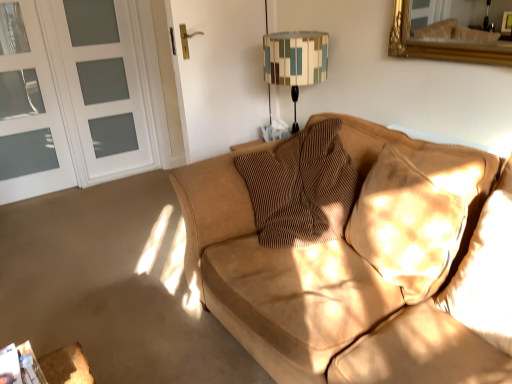
Image resolution: width=512 pixels, height=384 pixels. What do you see at coordinates (29, 110) in the screenshot?
I see `white glass screen door at left, placed as the 1th screen door when sorted from left to right` at bounding box center [29, 110].

This screenshot has height=384, width=512. What are the coordinates of `white glass screen door at left, placed as the 1th screen door when sorted from left to right` in the screenshot? It's located at (29, 110).

In order to face white frosted glass screen door at left, which is the 2th screen door in left-to-right order, should I rotate leftwards or rightwards?

Rotate your view left by about 19.313°.

Describe the element at coordinates (413, 216) in the screenshot. The image size is (512, 384). I see `suede pillow at right, positioned as the second pillow in right-to-left order` at that location.

What do you see at coordinates (301, 187) in the screenshot? This screenshot has height=384, width=512. I see `brown textured pillow at center, which is the 3th pillow from right to left` at bounding box center [301, 187].

Image resolution: width=512 pixels, height=384 pixels. In order to click on brown textured pillow at center, positioned as the 1th pillow in left-to-right order in this screenshot , I will do `click(301, 187)`.

Image resolution: width=512 pixels, height=384 pixels. What do you see at coordinates (487, 271) in the screenshot?
I see `suede pillow at right, the first pillow from the right` at bounding box center [487, 271].

What are the coordinates of `white glass screen door at left, placed as the 1th screen door when sorted from left to right` in the screenshot? It's located at (29, 110).

Looking at their sizes, would you say suede pillow at right, which is the second pillow from left to right, is wider or thinner than suede pillow at right, which ranks as the third pillow in left-to-right order?

suede pillow at right, which is the second pillow from left to right, is thinner than suede pillow at right, which ranks as the third pillow in left-to-right order.

Does suede pillow at right, which is the second pillow from left to right, appear on the right side of suede pillow at right, which ranks as the third pillow in left-to-right order?

Incorrect, suede pillow at right, which is the second pillow from left to right, is not on the right side of suede pillow at right, which ranks as the third pillow in left-to-right order.

Is point (403, 297) positioned before point (470, 308)?

No.

From the image's perspective, is white glass screen door at left, placed as the 1th screen door when sorted from left to right, on top of white frosted glass screen door at left, which ranks as the first screen door in right-to-left order?

No, from the image's perspective, white glass screen door at left, placed as the 1th screen door when sorted from left to right, is not on top of white frosted glass screen door at left, which ranks as the first screen door in right-to-left order.

Consider the image. Is white glass screen door at left, placed as the 1th screen door when sorted from left to right, completely or partially outside of white frosted glass screen door at left, which ranks as the first screen door in right-to-left order?

Yes, white glass screen door at left, placed as the 1th screen door when sorted from left to right, is not within white frosted glass screen door at left, which ranks as the first screen door in right-to-left order.

Which object is positioned more to the right, white glass screen door at left, the 2th screen door from the right, or white frosted glass screen door at left, which is the 2th screen door in left-to-right order?

white frosted glass screen door at left, which is the 2th screen door in left-to-right order, is more to the right.

In the scene shown: Can you confirm if white glass screen door at left, placed as the 1th screen door when sorted from left to right, is shorter than suede pillow at right, which ranks as the third pillow in left-to-right order?

No, white glass screen door at left, placed as the 1th screen door when sorted from left to right, is not shorter than suede pillow at right, which ranks as the third pillow in left-to-right order.

In the scene shown: From a real-world perspective, which object rests below the other?

suede pillow at right, which ranks as the third pillow in left-to-right order, is physically lower.

Is white glass screen door at left, the 2th screen door from the right, bigger or smaller than suede pillow at right, the first pillow from the right?

white glass screen door at left, the 2th screen door from the right, is bigger than suede pillow at right, the first pillow from the right.

Looking at this image, does geometric fabric lampshade at upper center turn towards suede pillow at right, which ranks as the third pillow in left-to-right order?

No, geometric fabric lampshade at upper center is not oriented towards suede pillow at right, which ranks as the third pillow in left-to-right order.

From the image's perspective, which object appears higher, geometric fabric lampshade at upper center or suede pillow at right, which ranks as the third pillow in left-to-right order?

geometric fabric lampshade at upper center.

Is geometric fabric lampshade at upper center in contact with suede pillow at right, which ranks as the third pillow in left-to-right order?

No.

Considering the sizes of objects geometric fabric lampshade at upper center and suede pillow at right, which ranks as the third pillow in left-to-right order, in the image provided, who is thinner, geometric fabric lampshade at upper center or suede pillow at right, which ranks as the third pillow in left-to-right order,?

Thinner between the two is suede pillow at right, which ranks as the third pillow in left-to-right order.

Is geometric fabric lampshade at upper center in front of or behind white frosted glass screen door at left, which ranks as the first screen door in right-to-left order, in the image?

Visually, geometric fabric lampshade at upper center is located in front of white frosted glass screen door at left, which ranks as the first screen door in right-to-left order.

Where is `table lamp above the white frosted glass screen door at left, which ranks as the first screen door in right-to-left order (from a real-world perspective)`? The image size is (512, 384). table lamp above the white frosted glass screen door at left, which ranks as the first screen door in right-to-left order (from a real-world perspective) is located at coordinates (295, 61).

From the image's perspective, would you say geometric fabric lampshade at upper center is positioned over white frosted glass screen door at left, which is the 2th screen door in left-to-right order?

No, from the image's perspective, geometric fabric lampshade at upper center is not over white frosted glass screen door at left, which is the 2th screen door in left-to-right order.

Considering the relative sizes of geometric fabric lampshade at upper center and white frosted glass screen door at left, which ranks as the first screen door in right-to-left order, in the image provided, is geometric fabric lampshade at upper center thinner than white frosted glass screen door at left, which ranks as the first screen door in right-to-left order,?

No, geometric fabric lampshade at upper center is not thinner than white frosted glass screen door at left, which ranks as the first screen door in right-to-left order.

Looking at their sizes, would you say brown textured pillow at center, positioned as the 1th pillow in left-to-right order, is wider or thinner than white glass screen door at left, the 2th screen door from the right?

Considering their sizes, brown textured pillow at center, positioned as the 1th pillow in left-to-right order, looks broader than white glass screen door at left, the 2th screen door from the right.

Would you say brown textured pillow at center, which is the 3th pillow from right to left, is to the left or to the right of white glass screen door at left, placed as the 1th screen door when sorted from left to right, in the picture?

Clearly, brown textured pillow at center, which is the 3th pillow from right to left, is on the right of white glass screen door at left, placed as the 1th screen door when sorted from left to right, in the image.

The image size is (512, 384). I want to click on screen door that is the 2nd object above the brown textured pillow at center, which is the 3th pillow from right to left (from a real-world perspective), so click(29, 110).

The image size is (512, 384). There is a geometric fabric lampshade at upper center. What are the coordinates of `the 2nd pillow below it (from a real-world perspective)` in the screenshot? It's located at (301, 187).

Considering their positions, is geometric fabric lampshade at upper center located in front of or behind brown textured pillow at center, which is the 3th pillow from right to left?

geometric fabric lampshade at upper center is positioned farther from the viewer than brown textured pillow at center, which is the 3th pillow from right to left.

Is geometric fabric lampshade at upper center far from brown textured pillow at center, positioned as the 1th pillow in left-to-right order?

No, geometric fabric lampshade at upper center is in close proximity to brown textured pillow at center, positioned as the 1th pillow in left-to-right order.

From a real-world perspective, which is physically above, geometric fabric lampshade at upper center or brown textured pillow at center, positioned as the 1th pillow in left-to-right order?

geometric fabric lampshade at upper center, from a real-world perspective.

Where is `pillow on the right of suede pillow at right, positioned as the second pillow in right-to-left order`? The image size is (512, 384). pillow on the right of suede pillow at right, positioned as the second pillow in right-to-left order is located at coordinates (487, 271).

At what (x,y) coordinates should I click in order to perform the action: click on screen door that appears behind the white glass screen door at left, placed as the 1th screen door when sorted from left to right. Please return your answer as a coordinate pair (x, y). This screenshot has height=384, width=512. Looking at the image, I should click on (106, 86).

Which object lies nearer to the anchor point brown textured pillow at center, which is the 3th pillow from right to left, suede pillow at right, which is the second pillow from left to right, or white frosted glass screen door at left, which is the 2th screen door in left-to-right order?

suede pillow at right, which is the second pillow from left to right, is positioned closer to the anchor brown textured pillow at center, which is the 3th pillow from right to left.

Based on their spatial positions, is suede pillow at right, which ranks as the third pillow in left-to-right order, or geometric fabric lampshade at upper center closer to brown textured pillow at center, which is the 3th pillow from right to left?

suede pillow at right, which ranks as the third pillow in left-to-right order.

When comparing their distances from white glass screen door at left, placed as the 1th screen door when sorted from left to right, does brown textured pillow at center, positioned as the 1th pillow in left-to-right order, or suede pillow at right, positioned as the second pillow in right-to-left order, seem further?

suede pillow at right, positioned as the second pillow in right-to-left order, is further to white glass screen door at left, placed as the 1th screen door when sorted from left to right.

Considering their positions, is white frosted glass screen door at left, which is the 2th screen door in left-to-right order, positioned closer to geometric fabric lampshade at upper center than suede pillow at right, positioned as the second pillow in right-to-left order?

suede pillow at right, positioned as the second pillow in right-to-left order.

When comparing their distances from white frosted glass screen door at left, which ranks as the first screen door in right-to-left order, does suede pillow at right, positioned as the second pillow in right-to-left order, or brown textured pillow at center, which is the 3th pillow from right to left, seem closer?

Based on the image, brown textured pillow at center, which is the 3th pillow from right to left, appears to be nearer to white frosted glass screen door at left, which ranks as the first screen door in right-to-left order.

Consider the image. Looking at the image, which one is located further to white frosted glass screen door at left, which is the 2th screen door in left-to-right order, white glass screen door at left, placed as the 1th screen door when sorted from left to right, or suede pillow at right, which ranks as the third pillow in left-to-right order?

suede pillow at right, which ranks as the third pillow in left-to-right order.

Estimate the real-world distances between objects in this image. Which object is closer to white glass screen door at left, the 2th screen door from the right, suede pillow at right, which ranks as the third pillow in left-to-right order, or suede pillow at right, positioned as the second pillow in right-to-left order?

suede pillow at right, positioned as the second pillow in right-to-left order.

Consider the image. Estimate the real-world distances between objects in this image. Which object is closer to geometric fabric lampshade at upper center, suede pillow at right, which is the second pillow from left to right, or brown textured pillow at center, which is the 3th pillow from right to left?

brown textured pillow at center, which is the 3th pillow from right to left, lies closer to geometric fabric lampshade at upper center than the other object.

This screenshot has width=512, height=384. Find the location of `pillow located between white glass screen door at left, placed as the 1th screen door when sorted from left to right, and suede pillow at right, positioned as the second pillow in right-to-left order, in the left-right direction`. pillow located between white glass screen door at left, placed as the 1th screen door when sorted from left to right, and suede pillow at right, positioned as the second pillow in right-to-left order, in the left-right direction is located at coordinates (301, 187).

The width and height of the screenshot is (512, 384). Find the location of `table lamp between white frosted glass screen door at left, which ranks as the first screen door in right-to-left order, and brown textured pillow at center, positioned as the 1th pillow in left-to-right order`. table lamp between white frosted glass screen door at left, which ranks as the first screen door in right-to-left order, and brown textured pillow at center, positioned as the 1th pillow in left-to-right order is located at coordinates (295, 61).

Identify the location of screen door situated between white glass screen door at left, the 2th screen door from the right, and geometric fabric lampshade at upper center from left to right. The width and height of the screenshot is (512, 384). click(106, 86).

Image resolution: width=512 pixels, height=384 pixels. What are the coordinates of `table lamp between white glass screen door at left, the 2th screen door from the right, and suede pillow at right, positioned as the second pillow in right-to-left order, in the horizontal direction` in the screenshot? It's located at (295, 61).